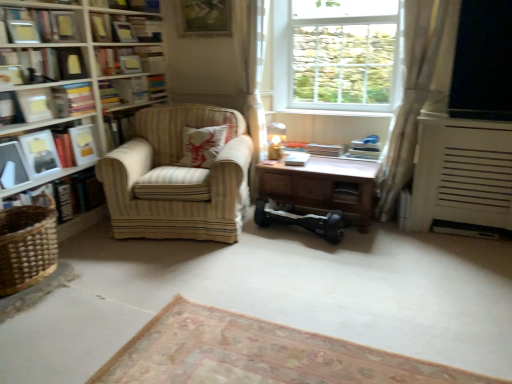
Where is `empty space that is ontop of wooden at upper center`? The height and width of the screenshot is (384, 512). empty space that is ontop of wooden at upper center is located at coordinates (333, 110).